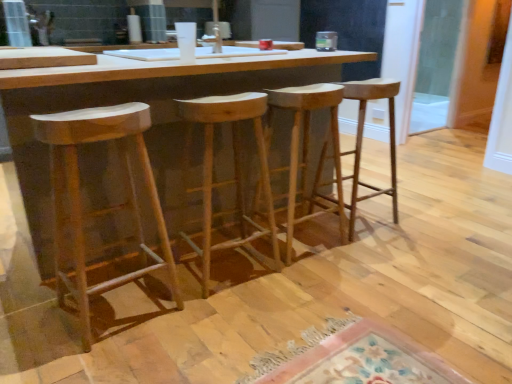
I want to click on vacant space underneath natural wood stool at center, the 1th stool in the right-to-left sequence (from a real-world perspective), so click(x=357, y=223).